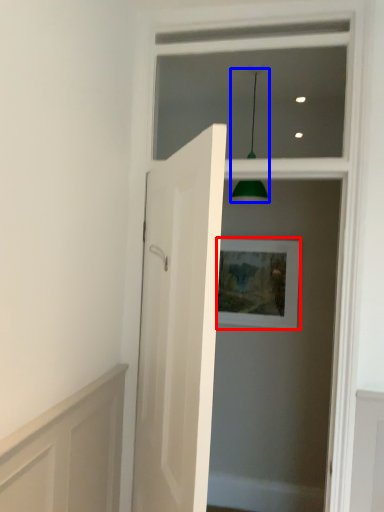
Question: Among these objects, which one is farthest to the camera, picture frame (highlighted by a red box) or light fixture (highlighted by a blue box)?

Choices:
 (A) picture frame
 (B) light fixture

Answer: (A)